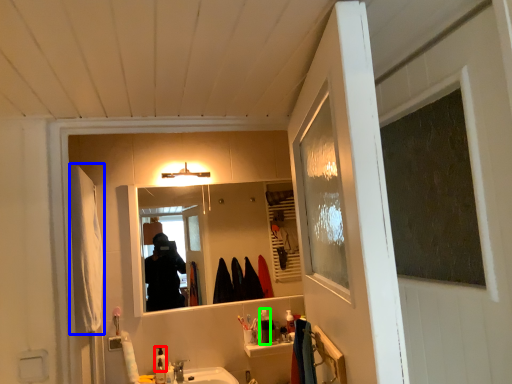
Question: Which is nearer to the toiletry (highlighted by a red box)? robe (highlighted by a blue box) or toiletry (highlighted by a green box).

Choices:
 (A) robe
 (B) toiletry

Answer: (B)